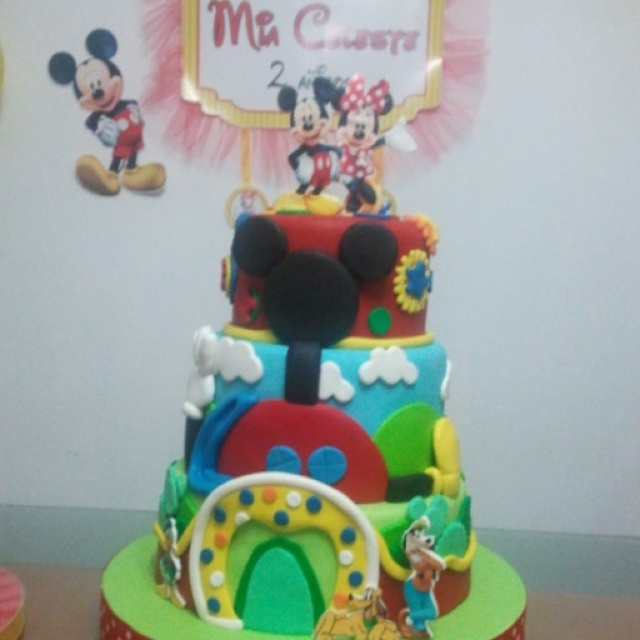
Question: Is smooth fondant cake at center positioned at the back of matte red plush toy at upper left?

Choices:
 (A) yes
 (B) no

Answer: (B)

Question: Estimate the real-world distances between objects in this image. Which object is closer to the smooth fondant cake at center?

Choices:
 (A) matte red minnie mouse at upper center
 (B) matte red plush toy at upper left

Answer: (A)

Question: Which of the following is the farthest from the observer?

Choices:
 (A) (282, 556)
 (B) (113, 136)
 (C) (330, 152)
 (D) (364, 147)

Answer: (B)

Question: Observing the image, what is the correct spatial positioning of matte red plush toy at upper left in reference to matte red minnie mouse at upper center?

Choices:
 (A) below
 (B) above

Answer: (B)

Question: Which point appears farthest from the camera in this image?

Choices:
 (A) (356, 173)
 (B) (125, 129)

Answer: (B)

Question: Does smooth fondant cake at center have a lesser width compared to smooth plastic mickey mouse at center?

Choices:
 (A) yes
 (B) no

Answer: (B)